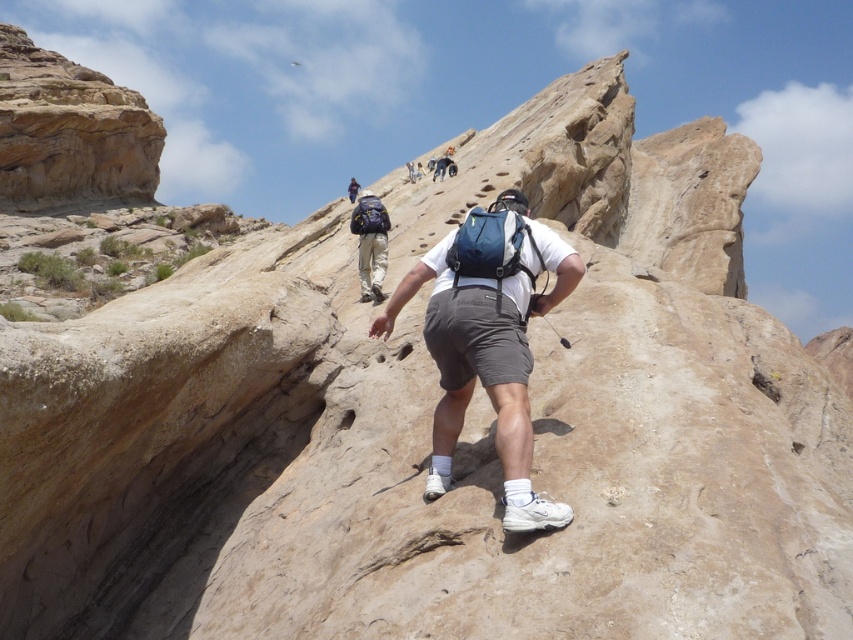
Question: Which point is closer to the camera taking this photo?

Choices:
 (A) click(x=354, y=179)
 (B) click(x=509, y=404)

Answer: (B)

Question: Observing the image, what is the correct spatial positioning of matte blue backpack at center in reference to matte black backpack at upper center?

Choices:
 (A) left
 (B) right

Answer: (B)

Question: Among these points, which one is farthest from the camera?

Choices:
 (A) (560, 289)
 (B) (347, 189)

Answer: (B)

Question: Can you confirm if matte blue backpack at center is positioned to the right of matte black backpack at upper center?

Choices:
 (A) no
 (B) yes

Answer: (B)

Question: Can you confirm if matte blue backpack at center is positioned to the right of matte black backpack at upper center?

Choices:
 (A) no
 (B) yes

Answer: (B)